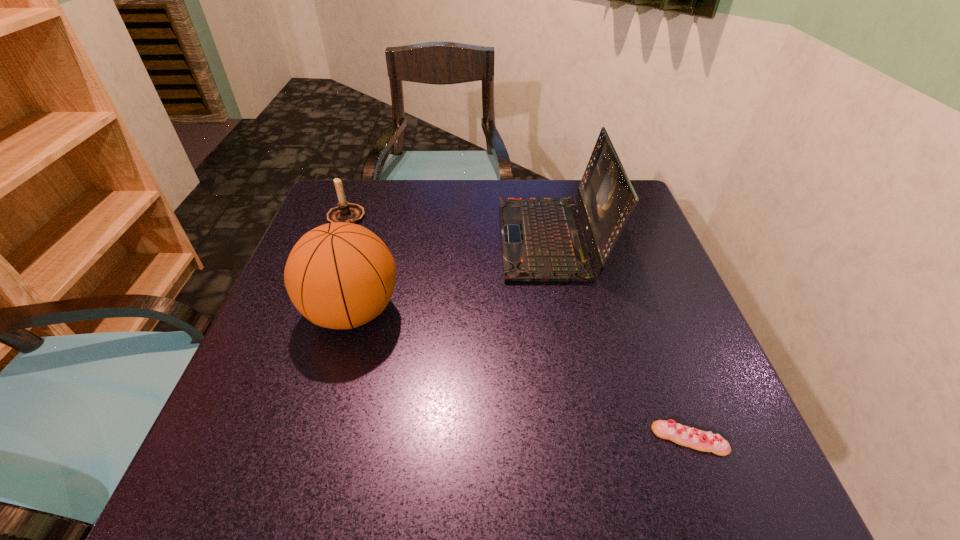
Identify the location of laptop computer. (542, 238).

This screenshot has width=960, height=540. In order to click on basketball in this screenshot , I will do `click(341, 275)`.

The height and width of the screenshot is (540, 960). Identify the location of the second shortest object. (347, 212).

Where is `eclair`? The height and width of the screenshot is (540, 960). eclair is located at coordinates (680, 434).

Image resolution: width=960 pixels, height=540 pixels. Identify the location of the nearest object. (680, 434).

Where is `free space located 0.340m on the screen of the laptop computer`? free space located 0.340m on the screen of the laptop computer is located at coordinates (364, 239).

What are the coordinates of `vacant space situated 0.170m on the screen of the laptop computer` in the screenshot? It's located at (433, 239).

Locate an element on the screen. The image size is (960, 540). free region located on the screen of the laptop computer is located at coordinates (469, 239).

Locate an element on the screen. This screenshot has width=960, height=540. free space located on the back of the basketball is located at coordinates (379, 219).

Find the location of a particular element. This screenshot has width=960, height=540. vacant region located on the back of the second shortest object is located at coordinates (354, 196).